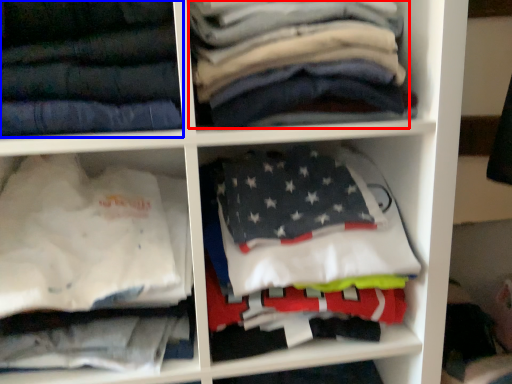
Question: Which object is further to the camera taking this photo, clothing (highlighted by a red box) or trousers (highlighted by a blue box)?

Choices:
 (A) clothing
 (B) trousers

Answer: (A)